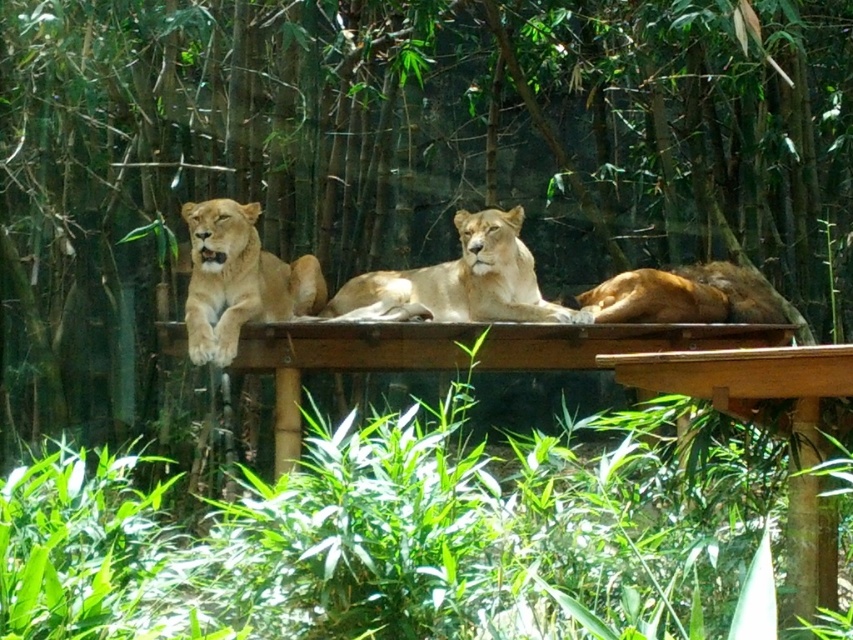
Question: From the image, what is the correct spatial relationship of golden fur lion at upper center in relation to golden fur lion at center?

Choices:
 (A) above
 (B) below

Answer: (A)

Question: Which object is positioned closest to the golden fur lion at upper center?

Choices:
 (A) light brown fur lion at center
 (B) golden fur lion at center

Answer: (A)

Question: Which point is farther to the camera?

Choices:
 (A) golden fur lion at upper center
 (B) light brown fur lion at center

Answer: (B)

Question: Which point is closer to the camera taking this photo?

Choices:
 (A) (641, 301)
 (B) (218, 266)
 (C) (508, 232)

Answer: (B)

Question: Is golden fur lion at upper center to the right of golden fur lion at center from the viewer's perspective?

Choices:
 (A) yes
 (B) no

Answer: (B)

Question: Is light brown fur lion at center bigger than golden fur lion at center?

Choices:
 (A) no
 (B) yes

Answer: (B)